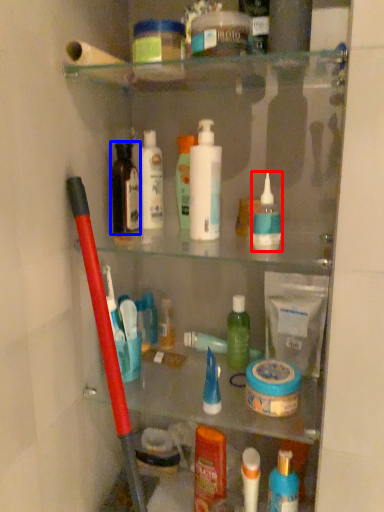
Question: Among these objects, which one is nearest to the camera, toiletry (highlighted by a red box) or toiletry (highlighted by a blue box)?

Choices:
 (A) toiletry
 (B) toiletry

Answer: (A)